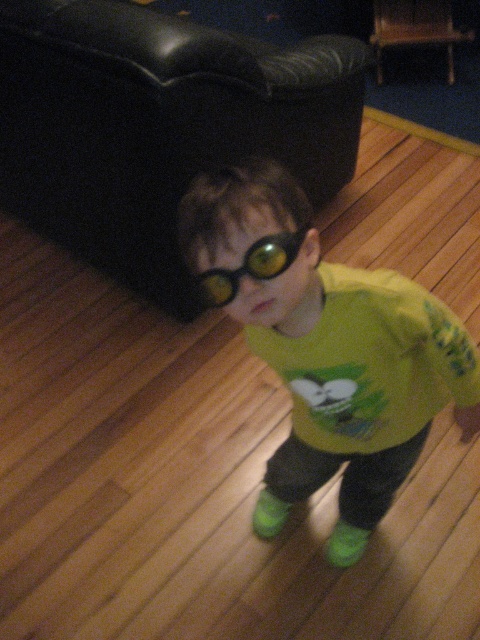
Between green matte shirt at center and green matte/glossy goggles at center, which one has more height?

With more height is green matte shirt at center.

Is green matte shirt at center to the right of green matte/glossy goggles at center from the viewer's perspective?

Indeed, green matte shirt at center is positioned on the right side of green matte/glossy goggles at center.

Where is `green matte shirt at center`? The image size is (480, 640). green matte shirt at center is located at coordinates (325, 348).